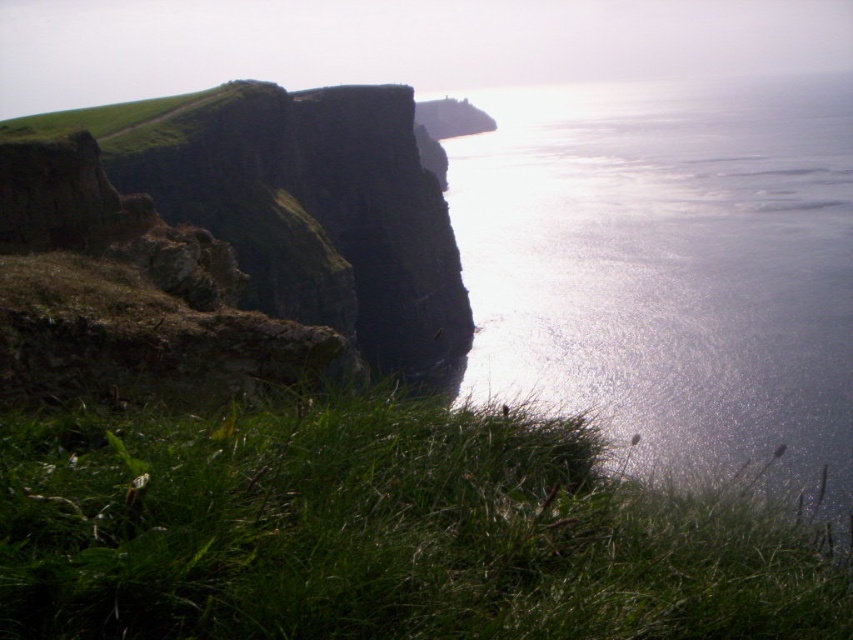
Identify the location of green grassy at lower left. (386, 532).

Is green grassy at lower left to the left of shiny reflective water at upper right from the viewer's perspective?

Indeed, green grassy at lower left is positioned on the left side of shiny reflective water at upper right.

Is point (323, 576) positioned before point (685, 324)?

Yes, point (323, 576) is in front of point (685, 324).

Find the location of a particular element. The width and height of the screenshot is (853, 640). green grassy at lower left is located at coordinates (386, 532).

Who is positioned more to the right, green grassy at lower left or green grassy hill at upper left?

Positioned to the right is green grassy at lower left.

Measure the distance between green grassy at lower left and camera.

A distance of 1.93 meters exists between green grassy at lower left and camera.

Which is in front, point (366, 625) or point (343, 92)?

Point (366, 625)

Where is `green grassy at lower left`? Image resolution: width=853 pixels, height=640 pixels. green grassy at lower left is located at coordinates (386, 532).

Can you confirm if shiny reflective water at upper right is positioned below green grassy hill at upper left?

No.

Locate an element on the screen. shiny reflective water at upper right is located at coordinates (669, 268).